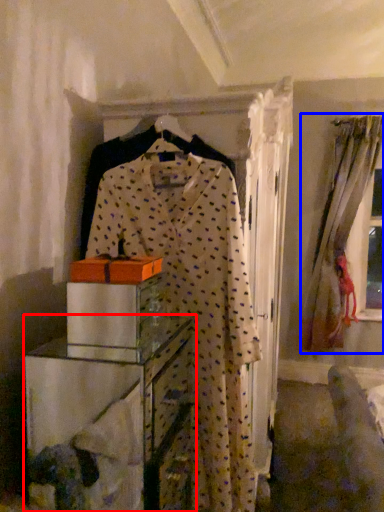
Question: Which of the following is the closest to the observer, furniture (highlighted by a red box) or window (highlighted by a blue box)?

Choices:
 (A) furniture
 (B) window

Answer: (A)